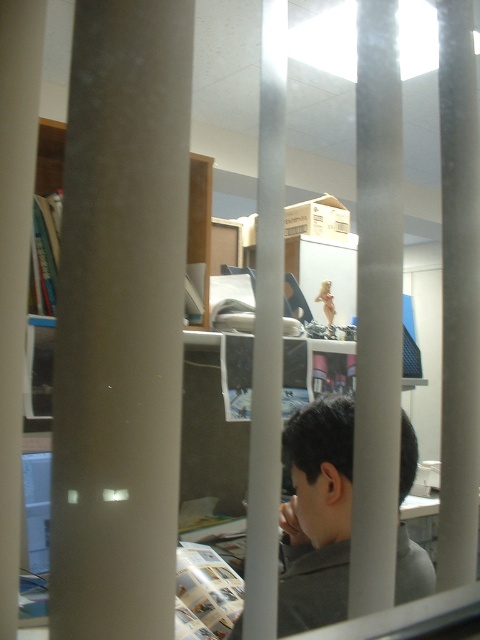
Is point (95, 432) positioned behind point (301, 508)?

That is False.

Is matte gray pillar at center further to camera compared to gray matte shirt at center?

No, it is not.

The width and height of the screenshot is (480, 640). Describe the element at coordinates (120, 321) in the screenshot. I see `matte gray pillar at center` at that location.

At what (x,y) coordinates should I click in order to perform the action: click on matte gray pillar at center. Please return your answer as a coordinate pair (x, y). The height and width of the screenshot is (640, 480). Looking at the image, I should click on click(x=120, y=321).